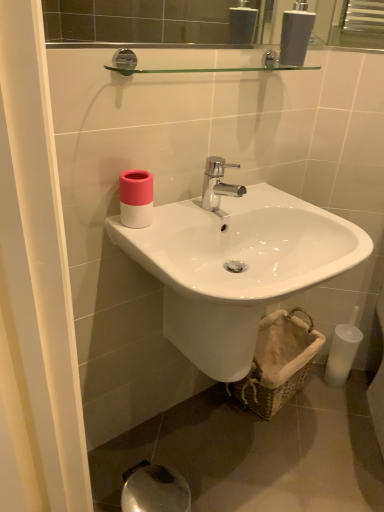
The image size is (384, 512). In order to click on spots to the right of pink matte cup at upper left in this screenshot , I will do `click(186, 215)`.